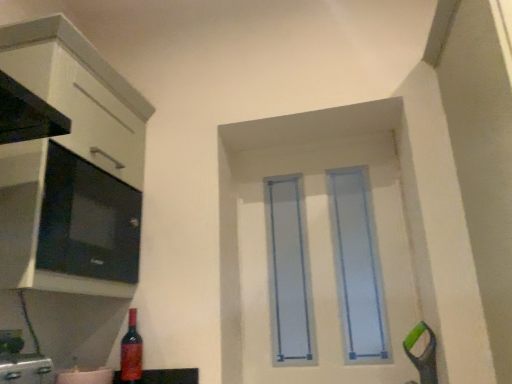
Question: Is shiny red glass bottle at lower left to the left or to the right of matte black microwave at left in the image?

Choices:
 (A) right
 (B) left

Answer: (A)

Question: Based on their sizes in the image, would you say shiny red glass bottle at lower left is bigger or smaller than matte black microwave at left?

Choices:
 (A) small
 (B) big

Answer: (A)

Question: Considering the real-world distances, which object is farthest from the shiny red glass bottle at lower left?

Choices:
 (A) white glossy cabinet at left
 (B) matte black microwave at left
 (C) light blue plastic door at center

Answer: (C)

Question: Which of these objects is positioned closest to the light blue plastic door at center?

Choices:
 (A) shiny red glass bottle at lower left
 (B) white glossy cabinet at left
 (C) matte black microwave at left

Answer: (C)